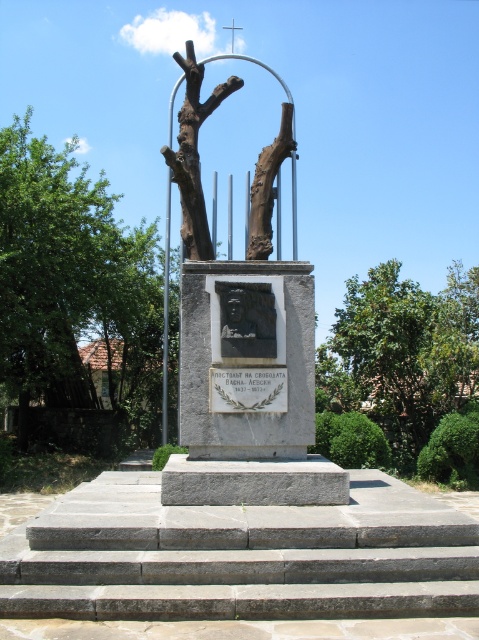
You are an artist planning to sketch the monument and its surroundings. You notice the brown rough bark at left and the rustic stone sculpture at center. Which object has a smaller diameter when viewed from above?

The brown rough bark at left has a smaller diameter than the rustic stone sculpture at center when viewed from above because it is thinner.

You are a visitor at the monument and want to take a photo of both the brown rough bark at left and the rustic stone sculpture at center. Which object should you focus on first to ensure both are in frame?

You should focus on the rustic stone sculpture at center first because it is taller than the brown rough bark at left, so positioning the camera to include its full height will naturally include the shorter brown rough bark at left in the frame.